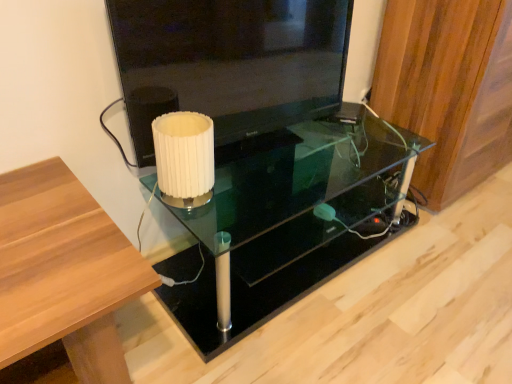
Question: Is white pleated paper at center at the left side of transparent glass table at center?

Choices:
 (A) yes
 (B) no

Answer: (A)

Question: Does white pleated paper at center lie behind transparent glass table at center?

Choices:
 (A) no
 (B) yes

Answer: (B)

Question: Is white pleated paper at center bigger than transparent glass table at center?

Choices:
 (A) yes
 (B) no

Answer: (B)

Question: Does white pleated paper at center contain transparent glass table at center?

Choices:
 (A) yes
 (B) no

Answer: (B)

Question: Does white pleated paper at center have a smaller size compared to transparent glass table at center?

Choices:
 (A) no
 (B) yes

Answer: (B)

Question: Would you say transparent glass table at center is inside or outside wooden panel at right?

Choices:
 (A) inside
 (B) outside

Answer: (B)

Question: From a real-world perspective, relative to wooden panel at right, is transparent glass table at center vertically above or below?

Choices:
 (A) above
 (B) below

Answer: (B)

Question: Is point (290, 160) closer or farther from the camera than point (467, 84)?

Choices:
 (A) closer
 (B) farther

Answer: (B)

Question: In terms of height, does transparent glass table at center look taller or shorter compared to wooden panel at right?

Choices:
 (A) short
 (B) tall

Answer: (A)

Question: From the image's perspective, relative to transparent glass table at center, is wooden panel at right above or below?

Choices:
 (A) above
 (B) below

Answer: (A)

Question: Considering the relative positions of wooden panel at right and transparent glass table at center in the image provided, is wooden panel at right to the left or to the right of transparent glass table at center?

Choices:
 (A) right
 (B) left

Answer: (A)

Question: Is wooden panel at right taller or shorter than transparent glass table at center?

Choices:
 (A) tall
 (B) short

Answer: (A)

Question: Is point (396, 87) positioned closer to the camera than point (233, 231)?

Choices:
 (A) closer
 (B) farther

Answer: (B)

Question: In terms of size, does transparent glass table at center appear bigger or smaller than white pleated paper at center?

Choices:
 (A) big
 (B) small

Answer: (A)

Question: Does point (324, 173) appear closer or farther from the camera than point (210, 163)?

Choices:
 (A) closer
 (B) farther

Answer: (B)